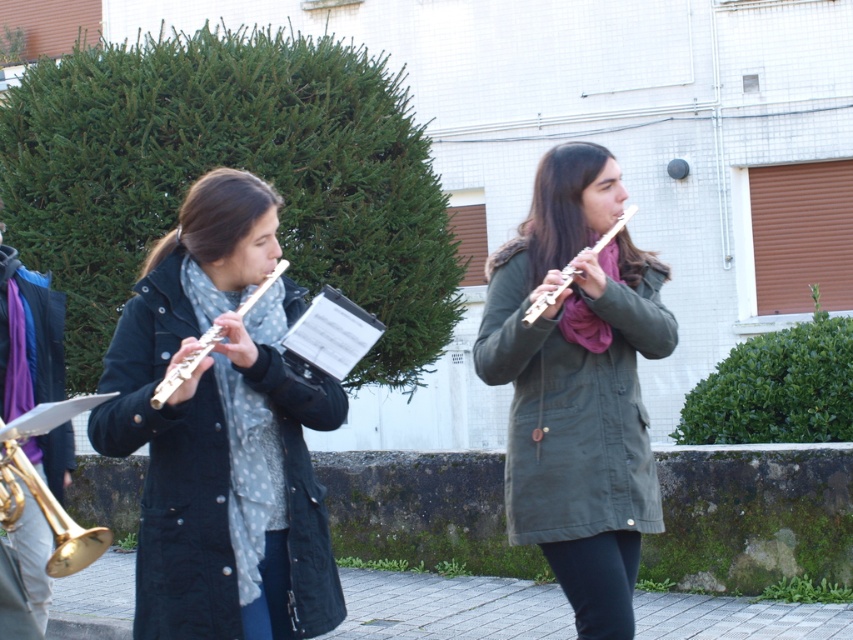
Can you confirm if gold brass hautboy at left is smaller than metallic silver flute at center?

No.

This screenshot has width=853, height=640. In order to click on gold brass hautboy at left in this screenshot , I will do `click(28, 337)`.

Is matte black coat at left to the left of gold brass trumpet at lower left from the viewer's perspective?

In fact, matte black coat at left is to the right of gold brass trumpet at lower left.

Measure the distance between point [224,276] and camera.

3.68 meters

The width and height of the screenshot is (853, 640). What do you see at coordinates (222, 432) in the screenshot? I see `matte black coat at left` at bounding box center [222, 432].

The image size is (853, 640). In order to click on matte black coat at left in this screenshot , I will do `click(222, 432)`.

Does matte black coat at left have a greater height compared to gold brass hautboy at left?

Incorrect, matte black coat at left's height is not larger of gold brass hautboy at left's.

Is matte black coat at left positioned before gold brass hautboy at left?

Yes, matte black coat at left is in front of gold brass hautboy at left.

The height and width of the screenshot is (640, 853). Describe the element at coordinates (222, 432) in the screenshot. I see `matte black coat at left` at that location.

Find the location of a particular element. Image resolution: width=853 pixels, height=640 pixels. matte black coat at left is located at coordinates (222, 432).